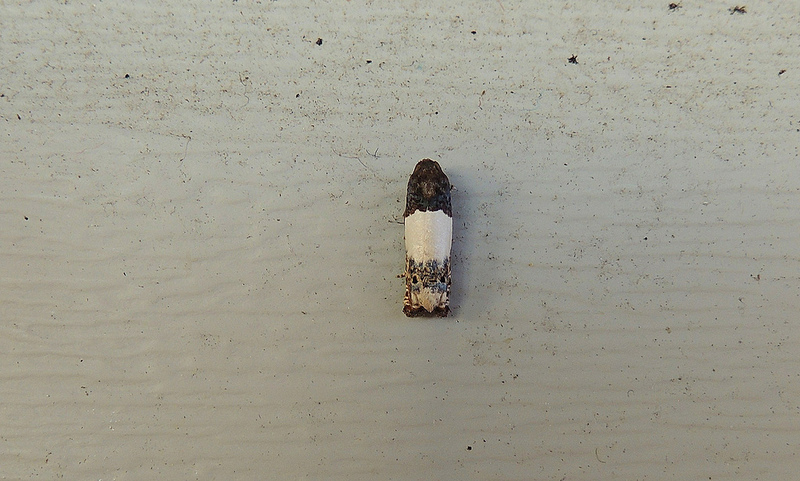
You are a GUI agent. You are given a task and a screenshot of the screen. Output one action in this format:
    pyautogui.click(x=<x>, y=<y>)
    Task: Click on the spots in wood
    
    Given the screenshot: What is the action you would take?
    pyautogui.click(x=125, y=74), pyautogui.click(x=318, y=41), pyautogui.click(x=572, y=54), pyautogui.click(x=673, y=3), pyautogui.click(x=738, y=10), pyautogui.click(x=781, y=71)